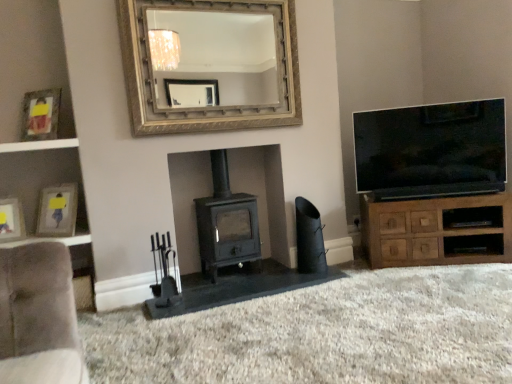
Question: From their relative heights in the image, would you say white glossy shelf at left is taller or shorter than matte gold picture frame at upper left, placed as the first picture frame when sorted from top to bottom?

Choices:
 (A) short
 (B) tall

Answer: (A)

Question: Is white glossy shelf at left bigger or smaller than matte gold picture frame at upper left, the third picture frame in the bottom-to-top sequence?

Choices:
 (A) big
 (B) small

Answer: (B)

Question: Which of these objects is positioned closest to the flat-screen tv at right?

Choices:
 (A) matte yellow picture frame at left, the 1th picture frame in the bottom-to-top sequence
 (B) matte black wood burning stove at center
 (C) black matte speaker at lower right
 (D) brown wood cabinet at right
 (E) white glossy shelf at left

Answer: (D)

Question: Based on their relative distances, which object is nearer to the matte gold picture frame at left, the second picture frame ordered from the bottom?

Choices:
 (A) matte yellow picture frame at left, arranged as the third picture frame when viewed from the top
 (B) gold textured mirror at upper center
 (C) matte black wood burning stove at center
 (D) matte gold picture frame at upper left, the third picture frame in the bottom-to-top sequence
 (E) black matte speaker at lower right

Answer: (A)